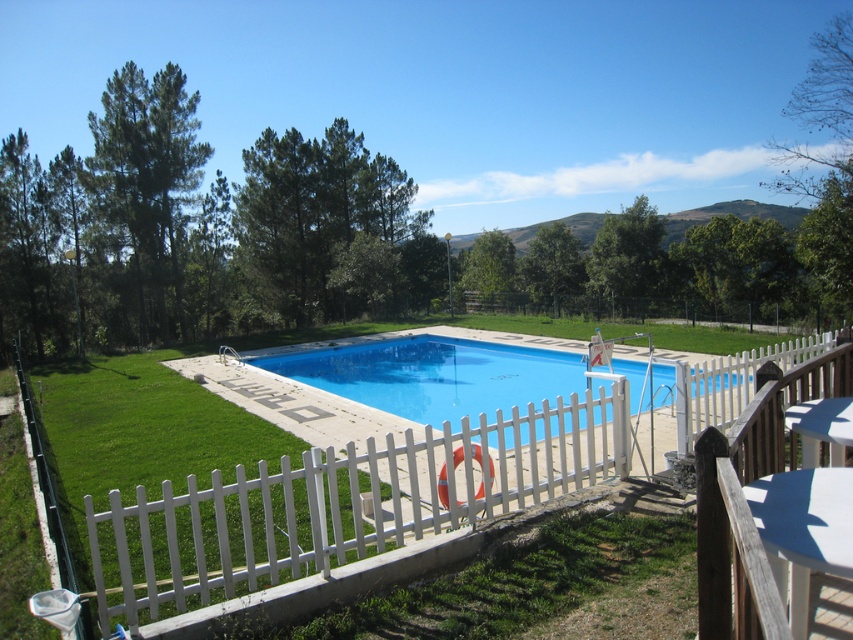
Question: Does white picket fence at center appear on the left side of blue smooth pool at center?

Choices:
 (A) no
 (B) yes

Answer: (B)

Question: Which point is farther from the camera taking this photo?

Choices:
 (A) (364, 376)
 (B) (149, 572)

Answer: (A)

Question: Which point is closer to the camera?

Choices:
 (A) (345, 362)
 (B) (276, 580)

Answer: (B)

Question: Can you confirm if white picket fence at center is bigger than blue smooth pool at center?

Choices:
 (A) no
 (B) yes

Answer: (A)

Question: Does white picket fence at center have a greater width compared to blue smooth pool at center?

Choices:
 (A) yes
 (B) no

Answer: (B)